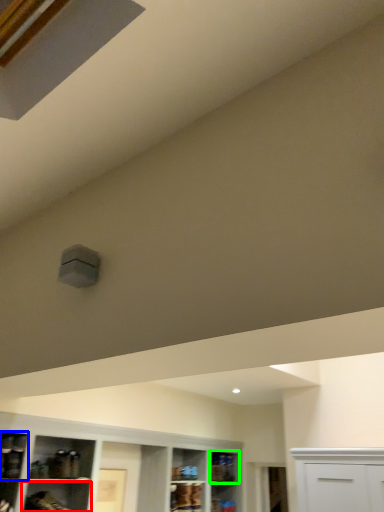
Question: Based on their relative distances, which object is farther from shelf (highlighted by a red box)? Choose from shelf (highlighted by a blue box) and shelf (highlighted by a green box).

Choices:
 (A) shelf
 (B) shelf

Answer: (B)